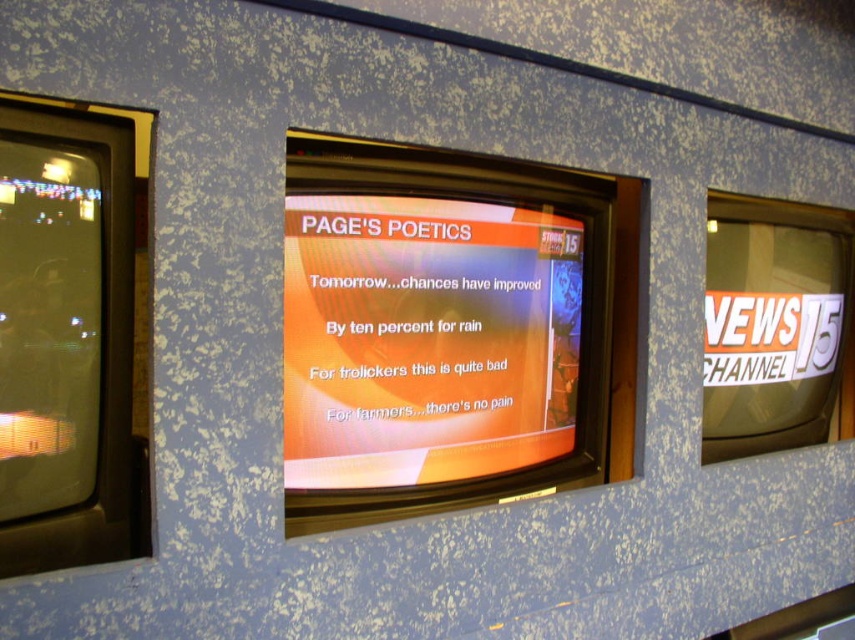
You are a studio technician checking the monitors. You notice the orange glossy text at center and the matte black screen at left. Which one has a larger display area?

The orange glossy text at center has a bigger display area than the matte black screen at left according to the description.

Based on the photo, you are a stagehand in a TV studio. You need to adjust the lighting so that both the orange glossy text at center and the matte black screen at left are clearly visible. Considering their positions and materials, which object should you focus the light on more to ensure visibility?

The matte black screen at left is behind orange glossy text at center, so you should focus the light on the matte black screen at left more because it is further away and may require more illumination to be seen clearly against the backdrop.

You are a studio technician adjusting camera angles. You need to ensure both the orange glossy text at center and the matte black screen at left are visible in the shot. Which object should you focus on first to account for their sizes?

The orange glossy text at center has a greater height compared to the matte black screen at left, so you should focus on the orange glossy text at center first to accommodate its larger size in the frame.